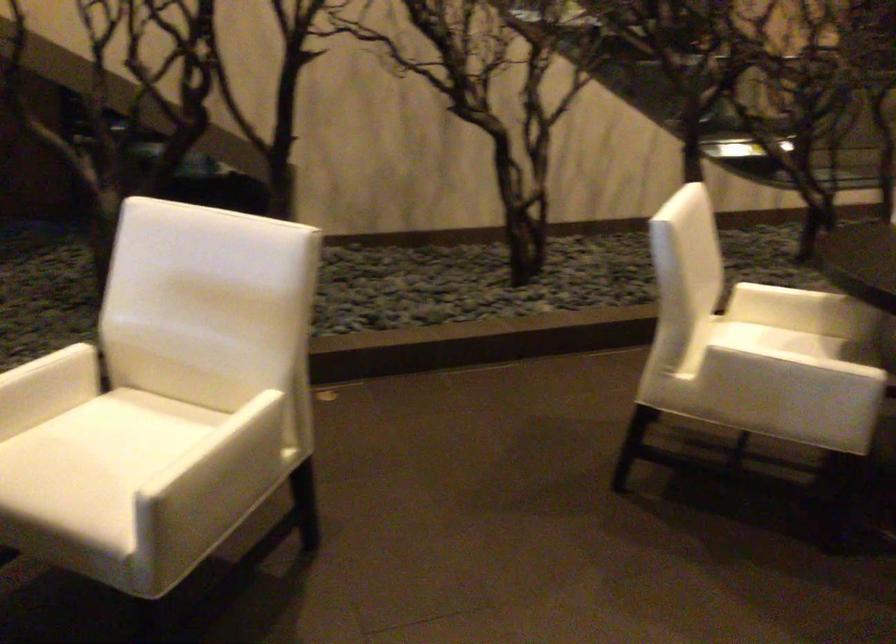
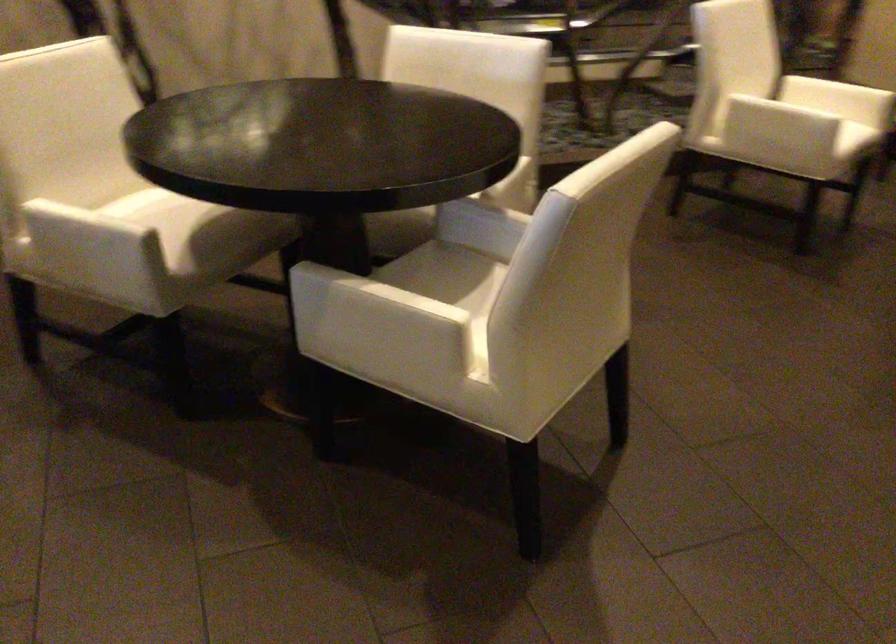
Question: In a continuous first-person perspective shot, in which direction is the camera moving?

Choices:
 (A) Left
 (B) Right
 (C) Forward
 (D) Backward

Answer: (B)